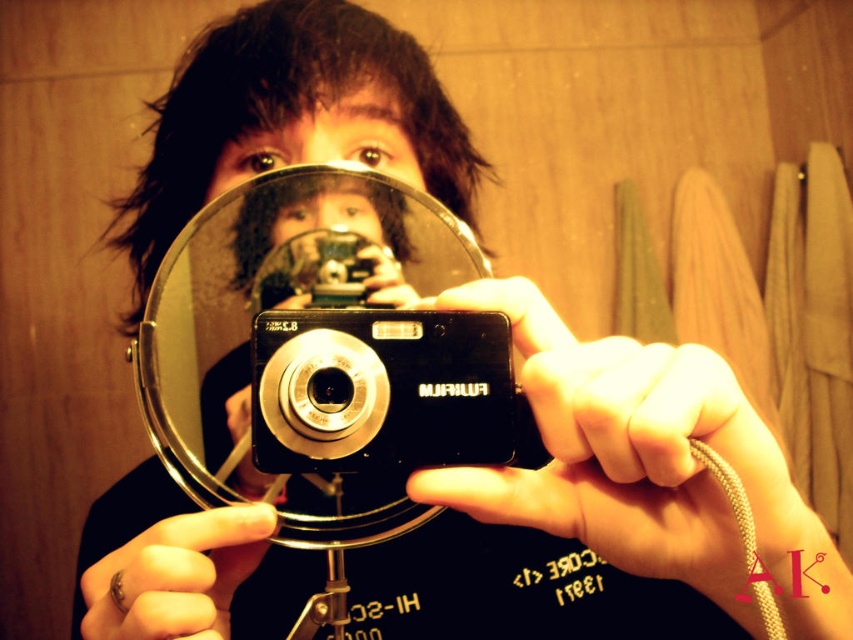
You are trying to take a selfie with the black plastic camera at center while looking into the clear glass mirror at center. Can you see the camera in the mirror?

→ The clear glass mirror at center is to the left of the black plastic camera at center, so yes, the camera will be visible in the mirror since the mirror is positioned to the side of the camera and can reflect its image.

You are trying to position a small sticker on the mirror in the center of the image. The sticker requires precise placement at coordinates point (325, 348). According to the scene description, where exactly should you place the sticker?

The point (325, 348) corresponds to the clear glass mirror at center, so you should place the sticker on the clear glass mirror at center at that coordinate.

You are trying to position a small sticker on the wooden background behind the clear glass mirror at center. According to the coordinates provided, where should you place the sticker relative to the mirror?

The clear glass mirror at center is located at point (x=325, y=348), so the sticker should be placed behind it on the wooden background at the same coordinates to ensure proper alignment.